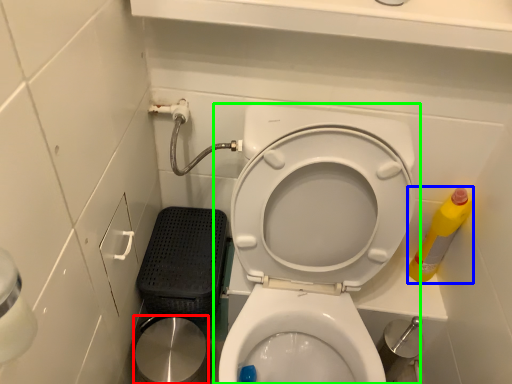
Question: Estimate the real-world distances between objects in this image. Which object is farther from potty (highlighted by a red box), cleaning product (highlighted by a blue box) or toilet (highlighted by a green box)?

Choices:
 (A) cleaning product
 (B) toilet

Answer: (A)